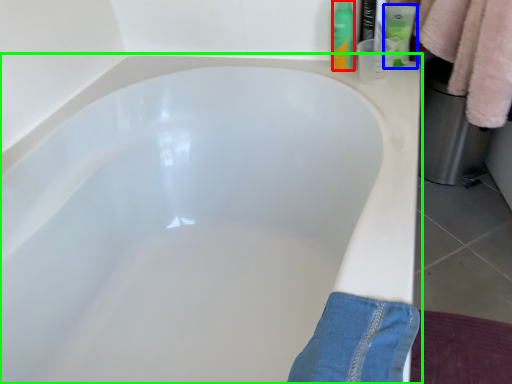
Question: Which object is positioned closest to toiletry (highlighted by a red box)? Select from toiletry (highlighted by a blue box) and bathtub (highlighted by a green box).

Choices:
 (A) toiletry
 (B) bathtub

Answer: (A)